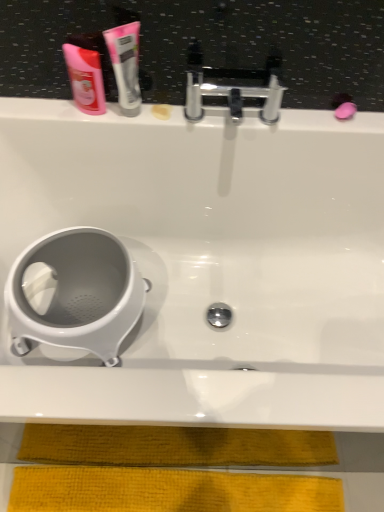
Question: Based on their positions, is white glossy bathtub at center located to the left or right of white plastic toilet at lower left?

Choices:
 (A) left
 (B) right

Answer: (B)

Question: Is white glossy bathtub at center inside the boundaries of white plastic toilet at lower left, or outside?

Choices:
 (A) inside
 (B) outside

Answer: (B)

Question: Which object is the farthest from the white plastic toilet at lower left?

Choices:
 (A) white glossy tube at upper center
 (B) polished chrome faucet at upper center
 (C) white glossy bathtub at center
 (D) pink glossy mouthwash at upper left

Answer: (B)

Question: Considering the real-world distances, which object is closest to the white glossy bathtub at center?

Choices:
 (A) polished chrome faucet at upper center
 (B) white plastic toilet at lower left
 (C) pink glossy mouthwash at upper left
 (D) white glossy tube at upper center

Answer: (B)